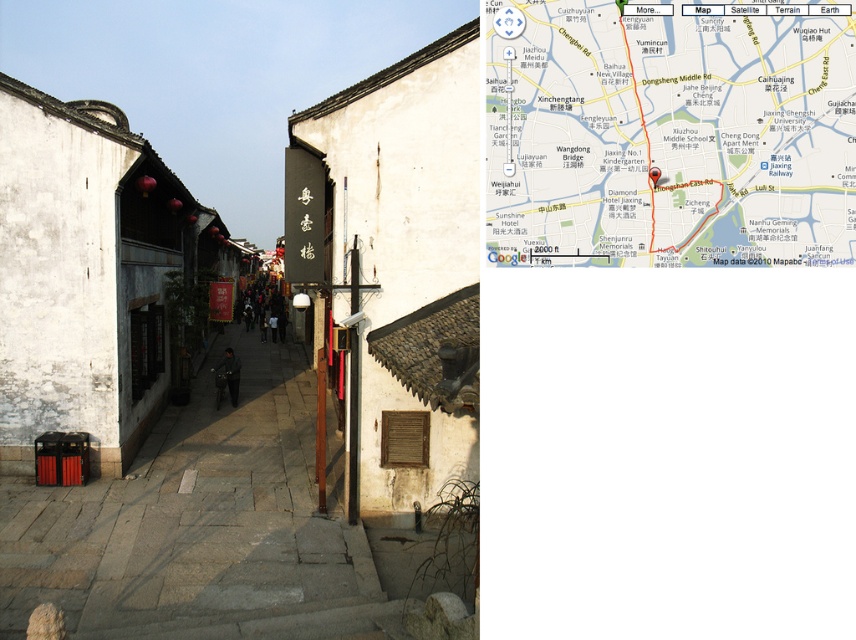
Is point (281, 392) positioned after point (331, 627)?

Yes.

Is matte stone alley at center taller than gray stone stairs at lower center?

Correct, matte stone alley at center is much taller as gray stone stairs at lower center.

What are the coordinates of `matte stone alley at center` in the screenshot? It's located at (200, 524).

How far apart are white paper map at center and matte stone alley at center?

The distance of white paper map at center from matte stone alley at center is 7.41 meters.

Which is more to the right, white paper map at center or matte stone alley at center?

white paper map at center is more to the right.

Find the location of a particular element. white paper map at center is located at coordinates (670, 132).

Can you confirm if white paper map at center is thinner than gray stone stairs at lower center?

Correct, white paper map at center's width is less than gray stone stairs at lower center's.

Is white paper map at center wider than gray stone stairs at lower center?

In fact, white paper map at center might be narrower than gray stone stairs at lower center.

Is point (562, 56) positioned behind point (400, 614)?

No, (562, 56) is closer to viewer.

Image resolution: width=856 pixels, height=640 pixels. Identify the location of white paper map at center. (670, 132).